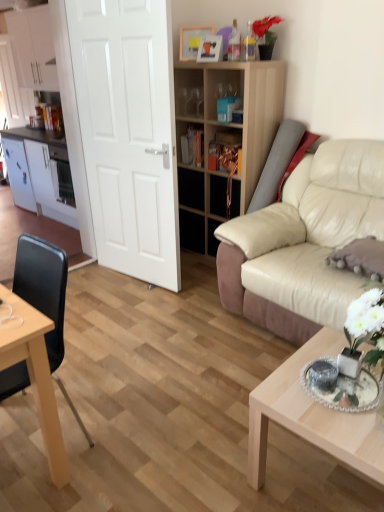
Where is `free location above light wood/texture coffee table at lower right (from a real-world perspective)`? free location above light wood/texture coffee table at lower right (from a real-world perspective) is located at coordinates 331,393.